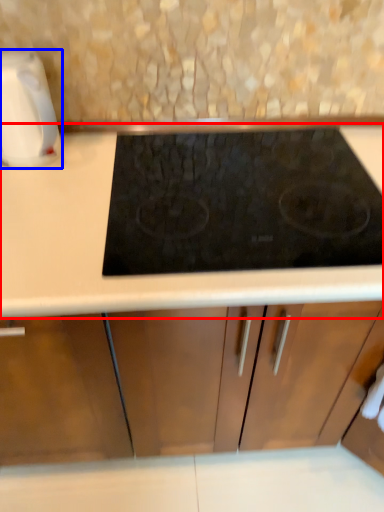
Question: Which point is closer to the camera, countertop (highlighted by a red box) or kitchen appliance (highlighted by a blue box)?

Choices:
 (A) countertop
 (B) kitchen appliance

Answer: (A)